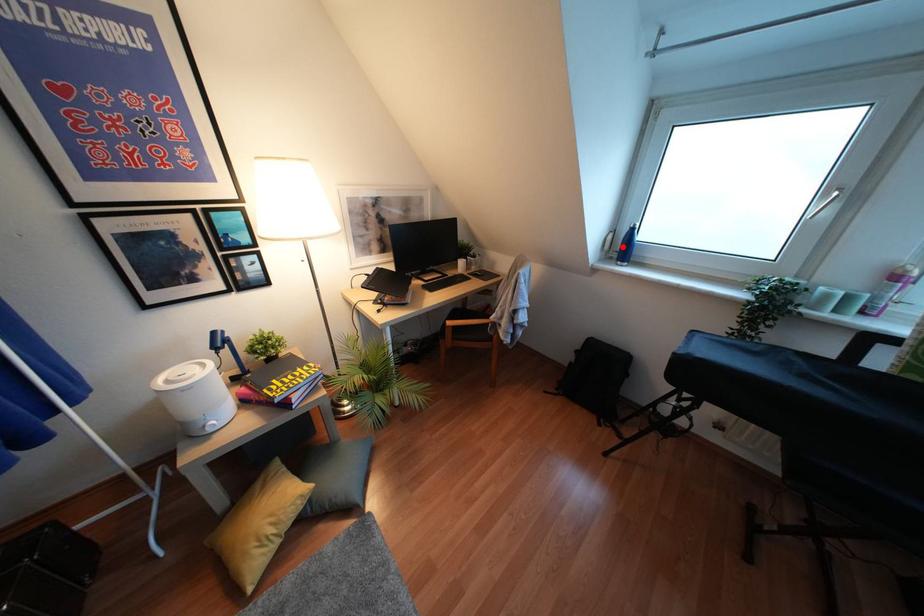
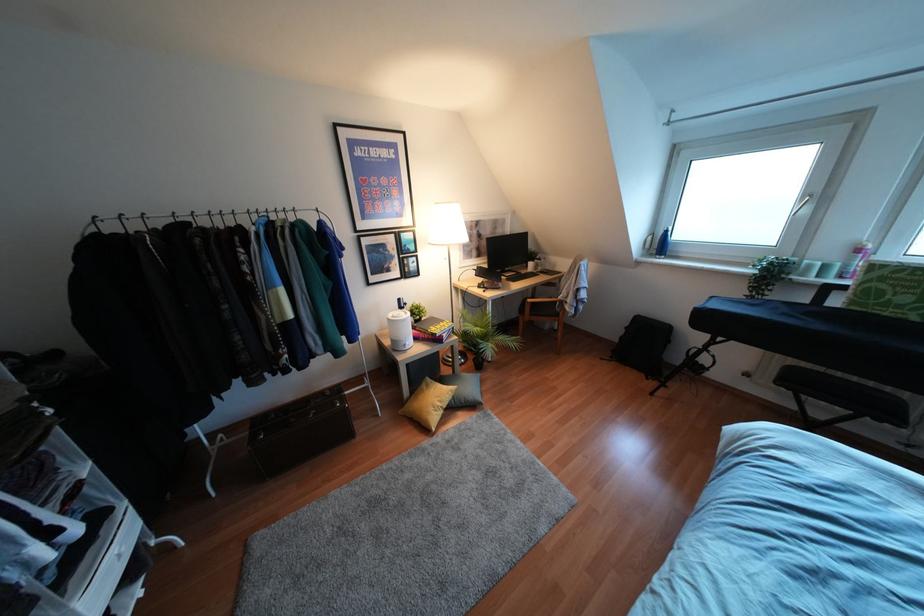
Find the pixel in the second image that matches the highlighted location in the first image.

(660, 245)